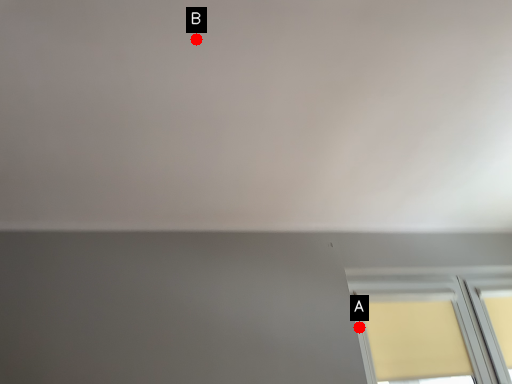
Question: Two points are circled on the image, labeled by A and B beside each circle. Which point appears closest to the camera in this image?

Choices:
 (A) A is closer
 (B) B is closer

Answer: (B)